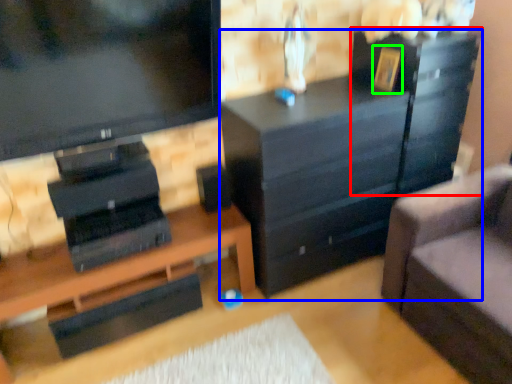
Question: Considering the real-world distances, which object is closest to file cabinet (highlighted by a red box)? chest of drawers (highlighted by a blue box) or picture frame (highlighted by a green box).

Choices:
 (A) chest of drawers
 (B) picture frame

Answer: (A)